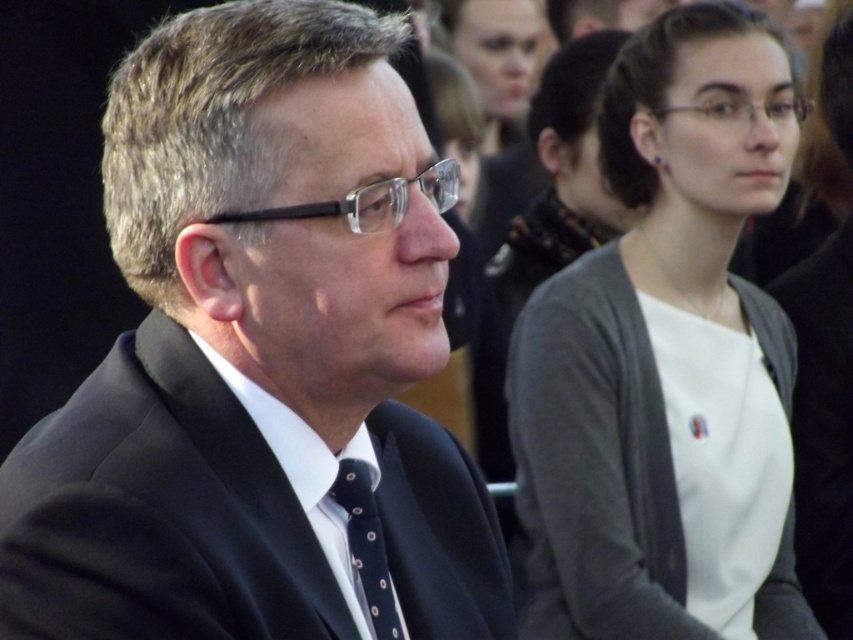
In the scene, there is a man wearing a black suit at left and a dark blue textured tie at center. Which object is taller?

The black suit at left is much taller than the dark blue textured tie at center.

You are organizing a charity event and need to arrange seating based on the size of the clothing items. If you have a table that can only accommodate items larger than the dark blue textured tie at center, will the black suit at left fit on the table?

The black suit at left is larger in size than the dark blue textured tie at center, so it will fit on the table designed for items larger than the dark blue textured tie at center.